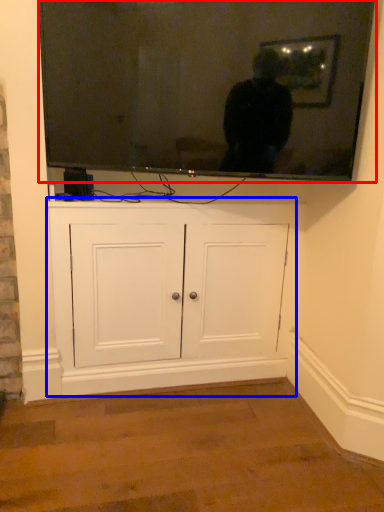
Question: Which point is further to the camera, television (highlighted by a red box) or cabinetry (highlighted by a blue box)?

Choices:
 (A) television
 (B) cabinetry

Answer: (B)